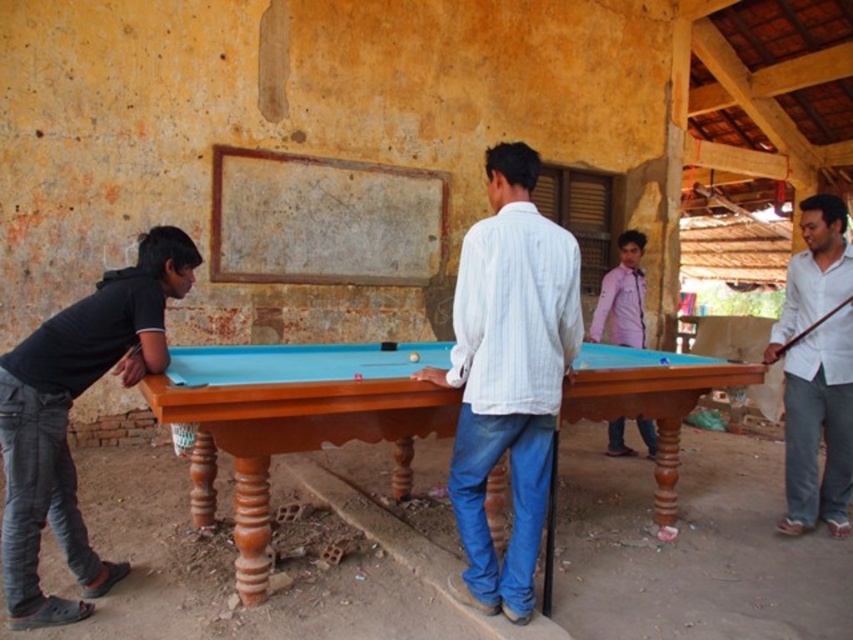
Question: Which point appears closest to the camera in this image?

Choices:
 (A) (607, 300)
 (B) (827, 202)
 (C) (610, 365)
 (D) (477, 564)

Answer: (D)

Question: Considering the real-world distances, which object is farthest from the white cotton shirt at right?

Choices:
 (A) pink cotton shirt at center
 (B) black cotton shirt at left
 (C) white cotton shirt at center
 (D) teal felt pool table at center

Answer: (B)

Question: Does white cotton shirt at center have a lesser width compared to black cotton shirt at left?

Choices:
 (A) no
 (B) yes

Answer: (B)

Question: Does black cotton shirt at left appear on the right side of pink cotton shirt at center?

Choices:
 (A) no
 (B) yes

Answer: (A)

Question: Is teal felt pool table at center below white cotton shirt at center?

Choices:
 (A) yes
 (B) no

Answer: (A)

Question: Among these points, which one is farthest from the camera?

Choices:
 (A) click(x=534, y=531)
 (B) click(x=70, y=321)
 (C) click(x=642, y=424)

Answer: (C)